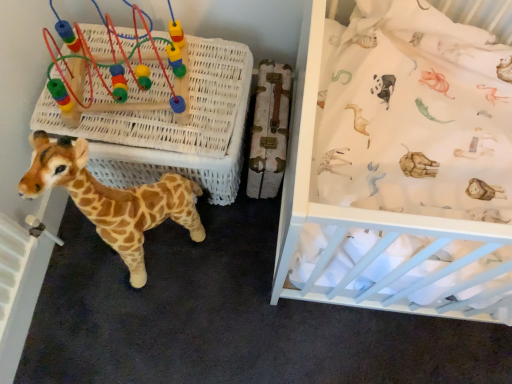
This screenshot has width=512, height=384. In order to click on spots to the right of plastic beads at upper left in this screenshot , I will do `click(211, 98)`.